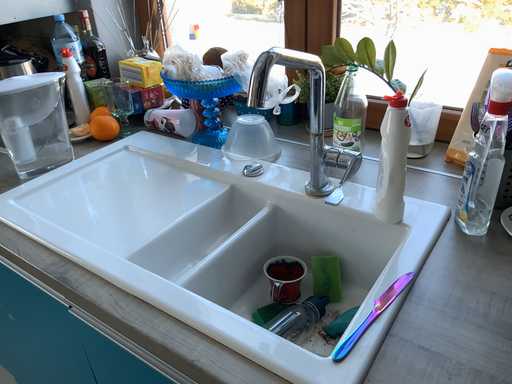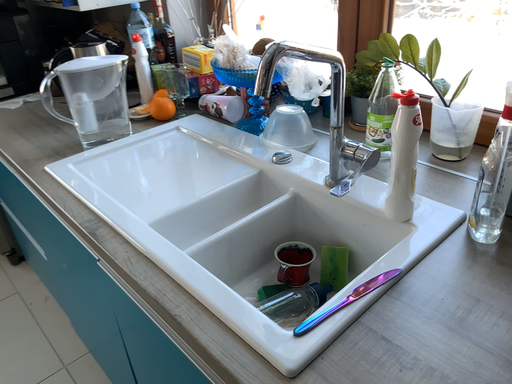
Question: Which way did the camera rotate in the video?

Choices:
 (A) rotated right
 (B) rotated left

Answer: (B)